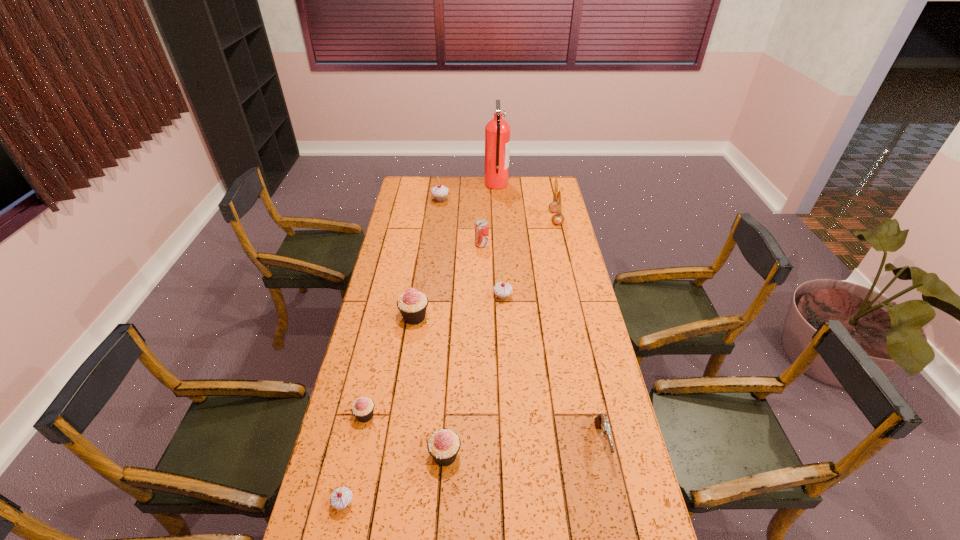
Locate an element on the screen. The image size is (960, 540). empty space that is in between the brown earphone and the farthest object is located at coordinates tap(526, 201).

This screenshot has height=540, width=960. In order to click on unoccupied area between the soda can and the biggest gray cupcake in this screenshot , I will do `click(461, 222)`.

Identify which object is located as the second nearest to the tallest object. Please provide its 2D coordinates. Your answer should be formatted as a tuple, i.e. [(x, y)], where the tuple contains the x and y coordinates of a point satisfying the conditions above.

[(556, 206)]

Locate an element on the screen. Image resolution: width=960 pixels, height=540 pixels. the ninth closest object to the second nearest gray cupcake is located at coordinates (341, 497).

At what (x,y) coordinates should I click in order to perform the action: click on cupcake that stands as the fourth closest to the nearest object. Please return your answer as a coordinate pair (x, y). Looking at the image, I should click on (502, 290).

Locate which cupcake is the fourth closest to the fourth farthest cupcake. Please provide its 2D coordinates. Your answer should be formatted as a tuple, i.e. [(x, y)], where the tuple contains the x and y coordinates of a point satisfying the conditions above.

[(502, 290)]

In order to click on gray cupcake that stands as the second closest to the fifth farthest cupcake in this screenshot , I will do `click(502, 290)`.

You are a GUI agent. You are given a task and a screenshot of the screen. Output one action in this format:
    pyautogui.click(x=<x>, y=<y>)
    Task: Click on the gray cupcake that stands as the second closest to the biggest pink cupcake
    The image size is (960, 540).
    Given the screenshot: What is the action you would take?
    (x=341, y=497)

The image size is (960, 540). I want to click on the closest pink cupcake to the fire extinguisher, so click(412, 304).

You are a GUI agent. You are given a task and a screenshot of the screen. Output one action in this format:
    pyautogui.click(x=<x>, y=<y>)
    Task: Click on the pink cupcake that is the second closest to the nearest pink cupcake
    The image size is (960, 540).
    Given the screenshot: What is the action you would take?
    [x=412, y=304]